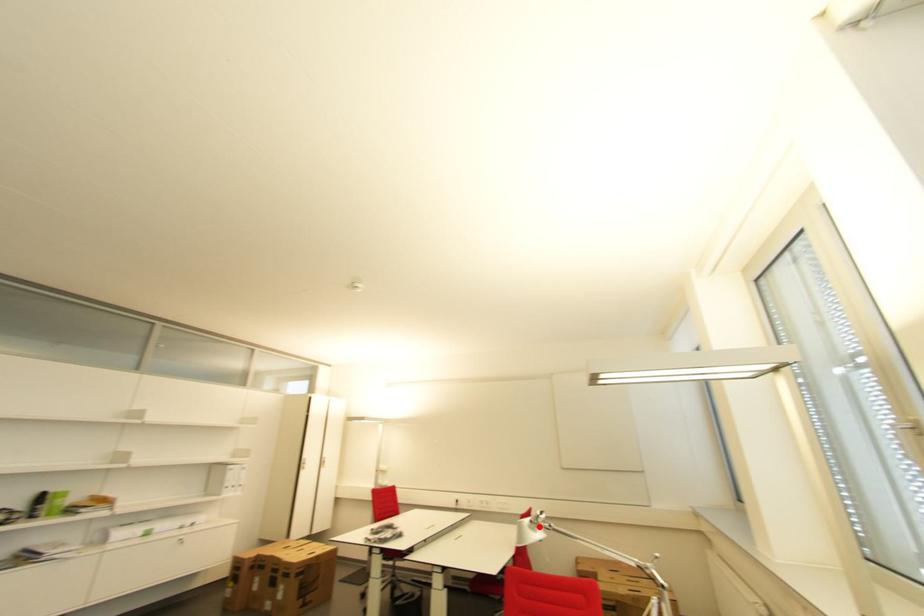
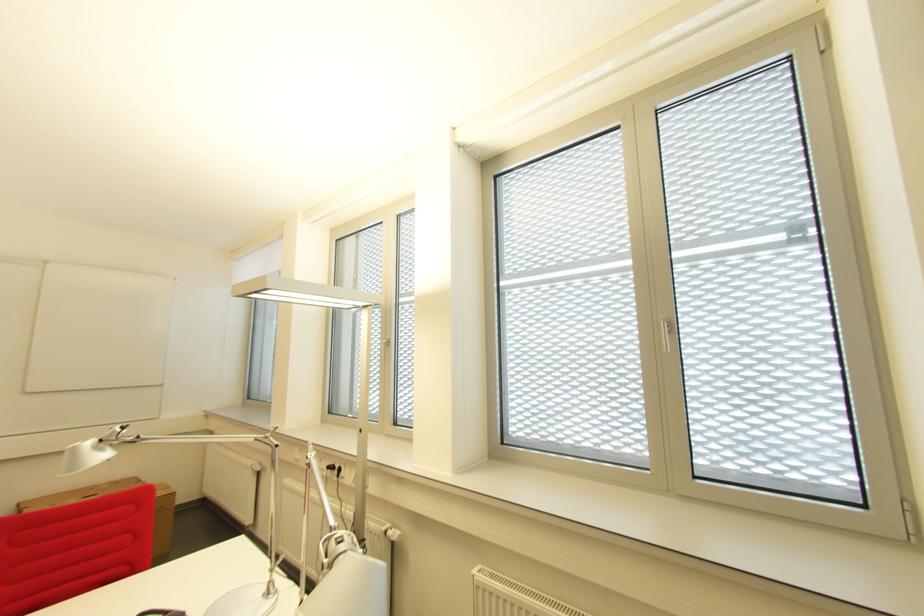
Find the pixel in the second image that matches the highlighted location in the first image.

(106, 447)